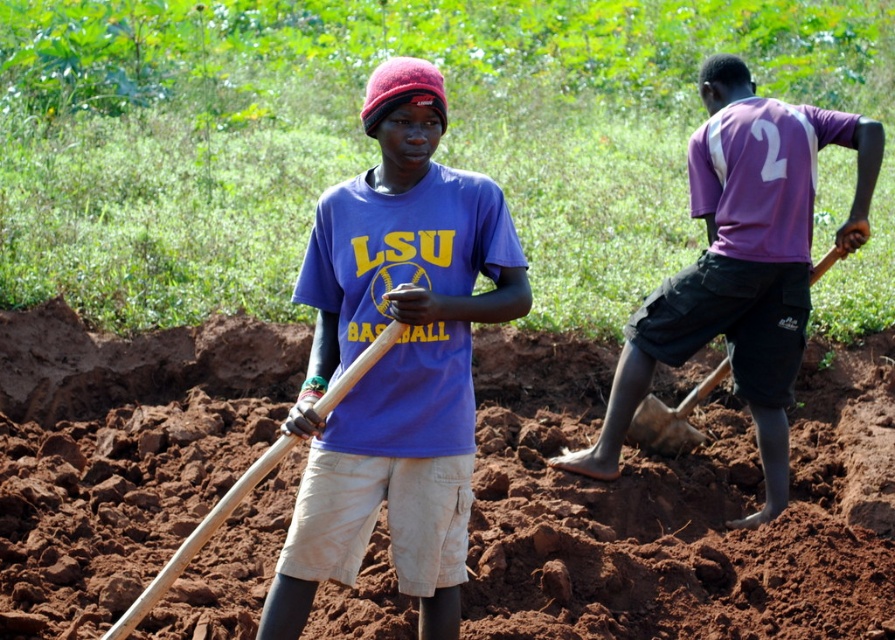
Which is more to the left, purple matte shirt at right or wooden shovel at right?

wooden shovel at right

Which is above, purple matte shirt at right or wooden shovel at right?

purple matte shirt at right is higher up.

The width and height of the screenshot is (895, 640). What do you see at coordinates (740, 264) in the screenshot?
I see `purple matte shirt at right` at bounding box center [740, 264].

Where is `purple matte shirt at right`? The height and width of the screenshot is (640, 895). purple matte shirt at right is located at coordinates pyautogui.click(x=740, y=264).

Is point (163, 333) positioned behind point (688, 420)?

That is True.

Describe the element at coordinates (678, 508) in the screenshot. The width and height of the screenshot is (895, 640). I see `brown soil at center` at that location.

Where is `brown soil at center`? The image size is (895, 640). brown soil at center is located at coordinates (678, 508).

What do you see at coordinates (678, 508) in the screenshot?
I see `brown soil at center` at bounding box center [678, 508].

At what (x,y) coordinates should I click in order to perform the action: click on brown soil at center. Please return your answer as a coordinate pair (x, y). Image resolution: width=895 pixels, height=640 pixels. Looking at the image, I should click on (678, 508).